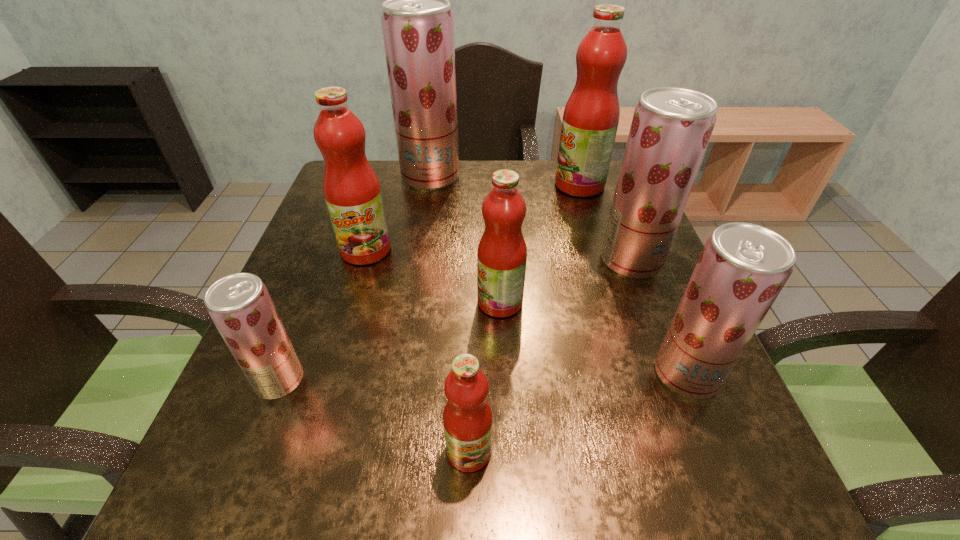
Locate an element on the screen. object that stands as the third closest to the smallest strawberry fruit juice is located at coordinates (502, 252).

Select which object is the seventh closest to the biggest strawberry fruit juice. Please provide its 2D coordinates. Your answer should be formatted as a tuple, i.e. [(x, y)], where the tuple contains the x and y coordinates of a point satisfying the conditions above.

[(467, 417)]

Where is `fruit juice that stands as the second closest to the farthest pink fruit juice`? The image size is (960, 540). fruit juice that stands as the second closest to the farthest pink fruit juice is located at coordinates (417, 23).

This screenshot has height=540, width=960. I want to click on the fourth closest fruit juice relative to the nearest fruit juice, so click(352, 192).

Identify which strawberry fruit juice is located as the second nearest to the third biggest strawberry fruit juice. Please provide its 2D coordinates. Your answer should be formatted as a tuple, i.e. [(x, y)], where the tuple contains the x and y coordinates of a point satisfying the conditions above.

[(240, 306)]

Identify which strawberry fruit juice is the second nearest to the biggest strawberry fruit juice. Please provide its 2D coordinates. Your answer should be formatted as a tuple, i.e. [(x, y)], where the tuple contains the x and y coordinates of a point satisfying the conditions above.

[(240, 306)]

You are a GUI agent. You are given a task and a screenshot of the screen. Output one action in this format:
    pyautogui.click(x=<x>, y=<y>)
    Task: Click on the pink fruit juice that is the second closest to the nearest object
    
    Given the screenshot: What is the action you would take?
    pyautogui.click(x=352, y=192)

Locate which pink fruit juice is the third closest to the rightmost pink fruit juice. Please provide its 2D coordinates. Your answer should be formatted as a tuple, i.e. [(x, y)], where the tuple contains the x and y coordinates of a point satisfying the conditions above.

[(467, 417)]

The height and width of the screenshot is (540, 960). I want to click on free spot that satisfies the following two spatial constraints: 1. on the front label of the second smallest strawberry fruit juice; 2. on the left side of the fourth nearest object, so click(x=503, y=374).

The width and height of the screenshot is (960, 540). Identify the location of vacant position in the image that satisfies the following two spatial constraints: 1. on the front label of the second smallest strawberry fruit juice; 2. on the left side of the third nearest pink fruit juice. (329, 374).